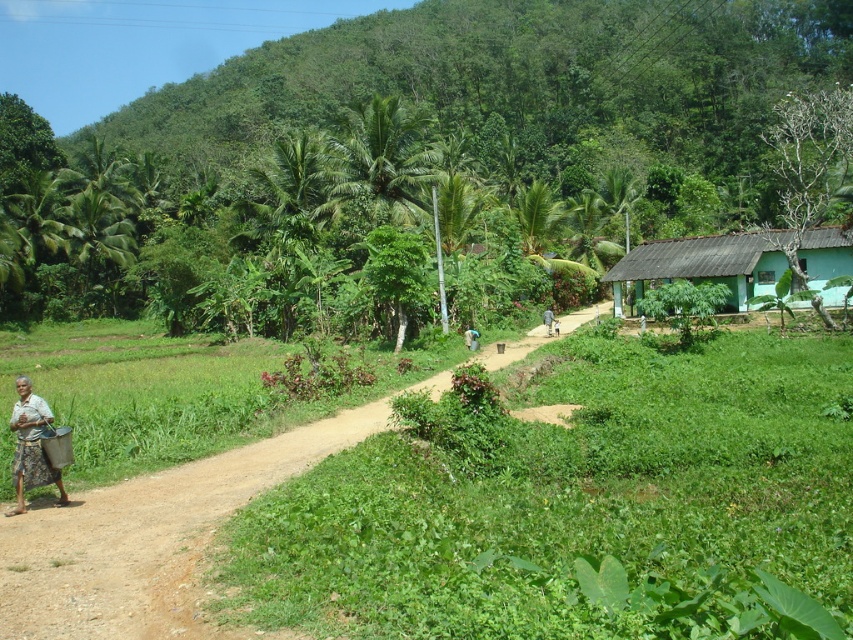
Question: Which object appears closest to the camera in this image?

Choices:
 (A) green leafy hillside at upper center
 (B) blue fabric bag at center

Answer: (B)

Question: Is green leafy hillside at upper center above blue fabric bag at center?

Choices:
 (A) yes
 (B) no

Answer: (A)

Question: Considering the real-world distances, which object is closest to the green leafy hillside at upper center?

Choices:
 (A) brown fabric person at center
 (B) blue fabric bag at center
 (C) green matte hut at right
 (D) white cotton shirt at lower left

Answer: (C)

Question: Is green matte hut at right above blue fabric bag at center?

Choices:
 (A) no
 (B) yes

Answer: (B)

Question: Which point appears farthest from the camera in this image?

Choices:
 (A) (19, 388)
 (B) (468, 344)

Answer: (B)

Question: Considering the relative positions of blue fabric bag at center and brown fabric person at center in the image provided, where is blue fabric bag at center located with respect to brown fabric person at center?

Choices:
 (A) left
 (B) right

Answer: (A)